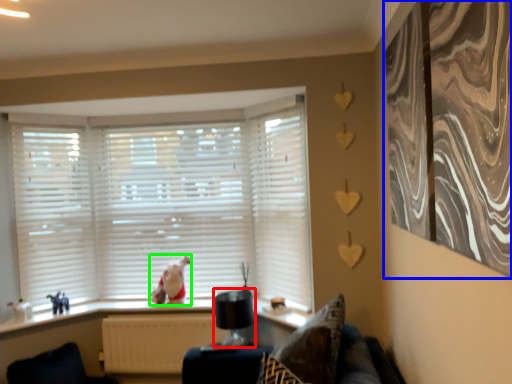
Question: Estimate the real-world distances between objects in this image. Which object is farther from lamp (highlighted by a red box), curtain (highlighted by a blue box) or animal (highlighted by a green box)?

Choices:
 (A) curtain
 (B) animal

Answer: (A)